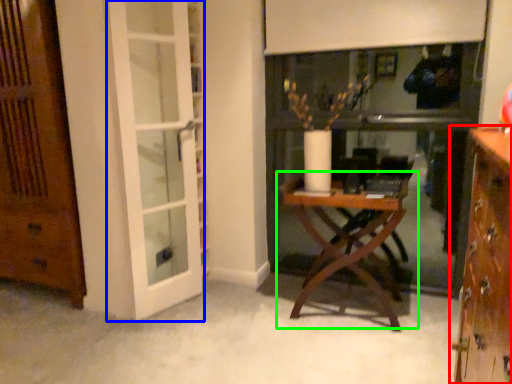
Question: Which object is the closest to the cabinetry (highlighted by a red box)? Choose among these: screen door (highlighted by a blue box) or table (highlighted by a green box).

Choices:
 (A) screen door
 (B) table

Answer: (B)